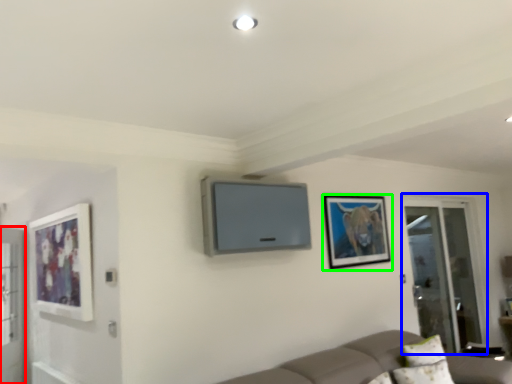
Question: Which object is the farthest from screen door (highlighted by a red box)? Choose among these: screen door (highlighted by a blue box) or picture frame (highlighted by a green box).

Choices:
 (A) screen door
 (B) picture frame

Answer: (A)